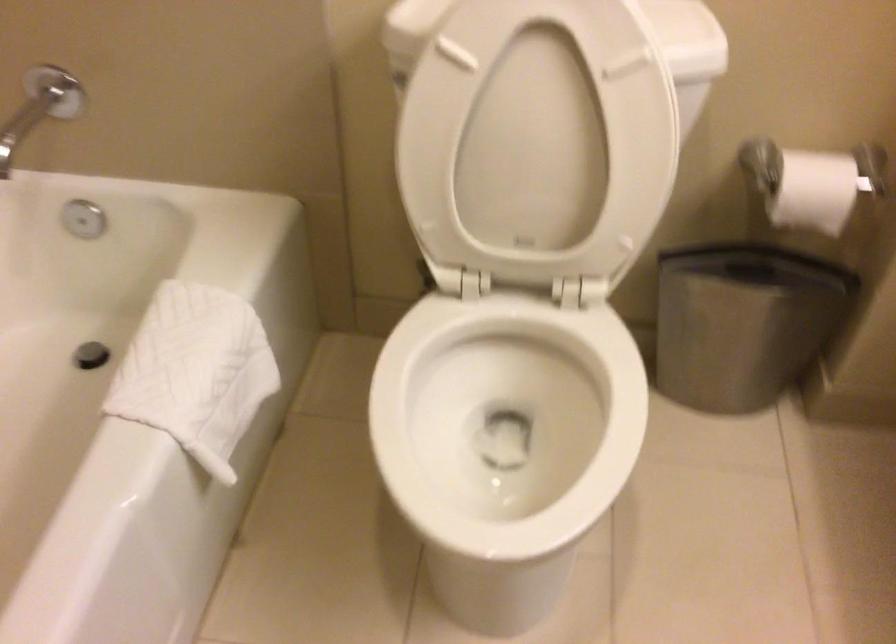
Image resolution: width=896 pixels, height=644 pixels. In order to click on white towel in this screenshot , I will do `click(195, 372)`.